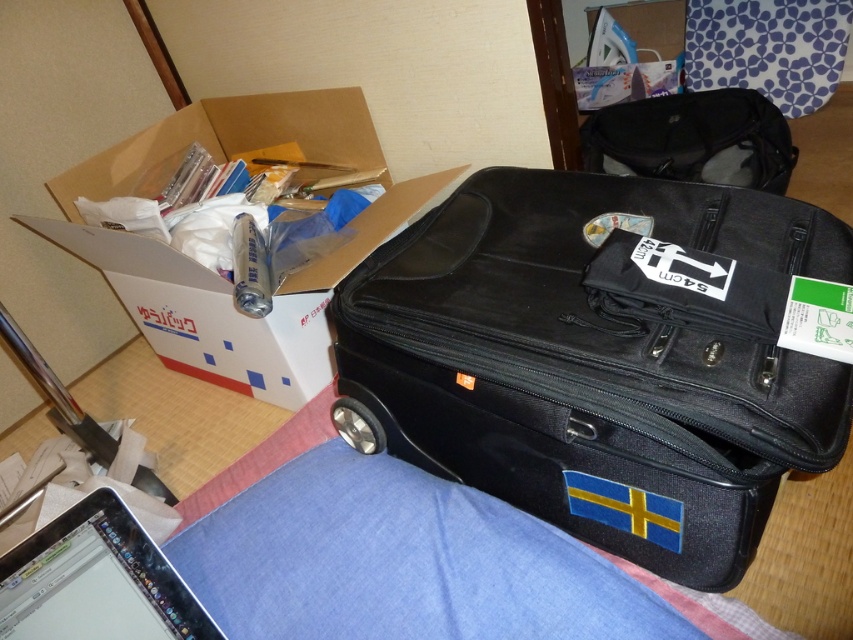
Question: Does sleek silver laptop at lower left come in front of matte black bag at upper right?

Choices:
 (A) no
 (B) yes

Answer: (B)

Question: Which point is farther from the camera taking this photo?

Choices:
 (A) coord(786,161)
 (B) coord(444,467)
 (C) coord(39,616)

Answer: (A)

Question: Which object is closer to the camera taking this photo?

Choices:
 (A) sleek silver laptop at lower left
 (B) white cardboard box at upper left

Answer: (A)

Question: In this image, where is black fabric suitcase at center located relative to matte black bag at upper right?

Choices:
 (A) left
 (B) right

Answer: (A)

Question: Does black fabric suitcase at center appear on the left side of matte black bag at upper right?

Choices:
 (A) yes
 (B) no

Answer: (A)

Question: Which of the following is the closest to the observer?

Choices:
 (A) (241, 339)
 (B) (339, 385)
 (C) (144, 621)
 (D) (635, 157)

Answer: (C)